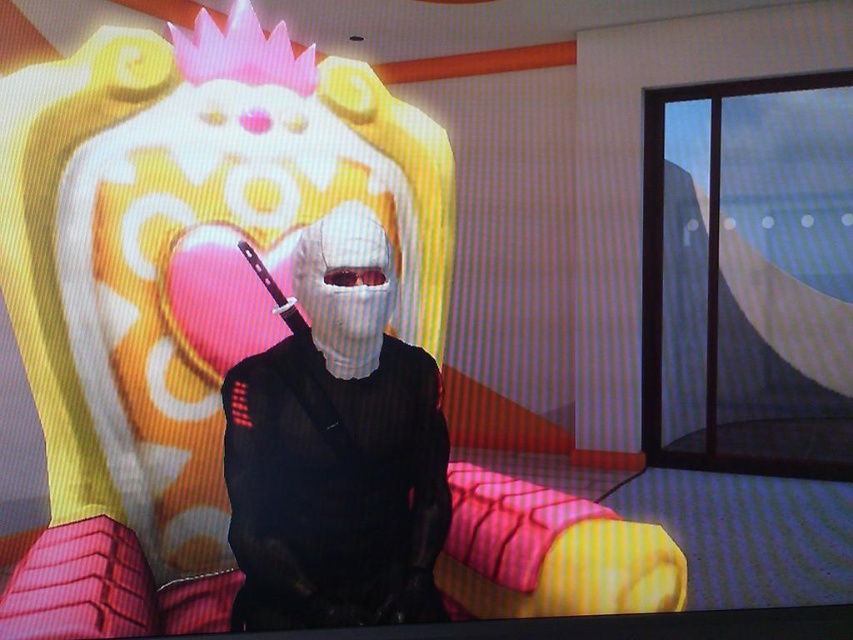
You are a game developer designing a level where the white matte mask at center and the matte black knife at center are placed in the foreground. If a player needs to reach the knife first before the mask, which object should they move towards first?

The player should move towards the matte black knife at center first because it is positioned to the left of the white matte mask at center, making it closer to the starting point if the player is approaching from the left side of the frame.

In the scene shown: You are a character in the game and need to move from your current position to the point labeled as point (299, 332). However, there is an obstacle at point (370, 316). Can you safely navigate around it without passing through the obstacle?

Point (370, 316) is in front of point (299, 332), so you cannot safely navigate around it without passing through the obstacle.

You are a character in the game who needs to retrieve the matte black knife at center without touching the white matte mask at center. Is this possible given their positions?

The white matte mask at center is in front of the matte black knife at center, so you would need to move the white matte mask at center out of the way first to access the matte black knife at center without touching it.